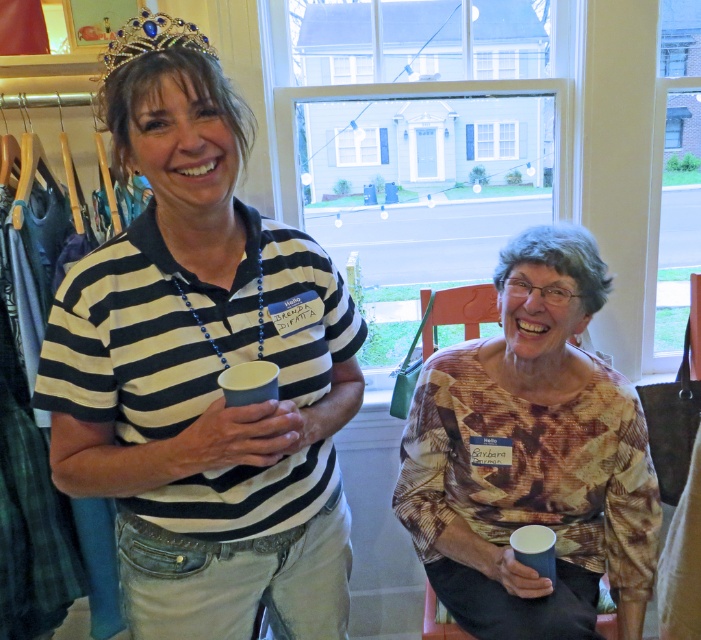
Can you confirm if striped cotton shirt at center is shorter than printed fabric blouse at center?

No.

Does striped cotton shirt at center appear over printed fabric blouse at center?

Indeed, striped cotton shirt at center is positioned over printed fabric blouse at center.

Identify the location of striped cotton shirt at center. (204, 376).

Which of these two, printed fabric blouse at center or gold beaded crown at upper center, stands taller?

printed fabric blouse at center

Where is `printed fabric blouse at center`? printed fabric blouse at center is located at coordinates (531, 458).

The width and height of the screenshot is (701, 640). I want to click on printed fabric blouse at center, so click(x=531, y=458).

The image size is (701, 640). I want to click on printed fabric blouse at center, so coord(531,458).

Is striped cotton shirt at center closer to the viewer compared to gold beaded crown at upper center?

Yes, striped cotton shirt at center is closer to the viewer.

Can you confirm if striped cotton shirt at center is wider than gold beaded crown at upper center?

Indeed, striped cotton shirt at center has a greater width compared to gold beaded crown at upper center.

Where is `striped cotton shirt at center`? The height and width of the screenshot is (640, 701). striped cotton shirt at center is located at coordinates (204, 376).